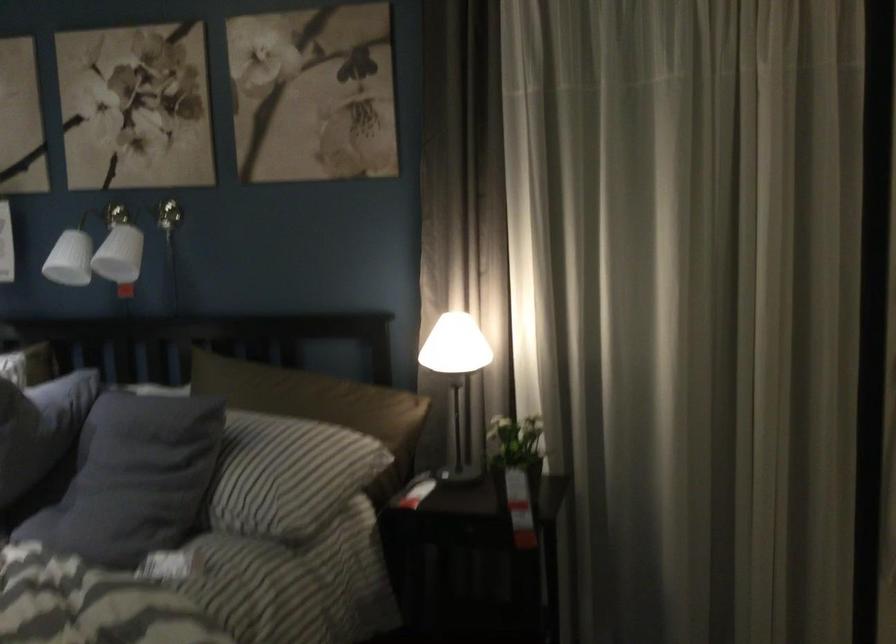
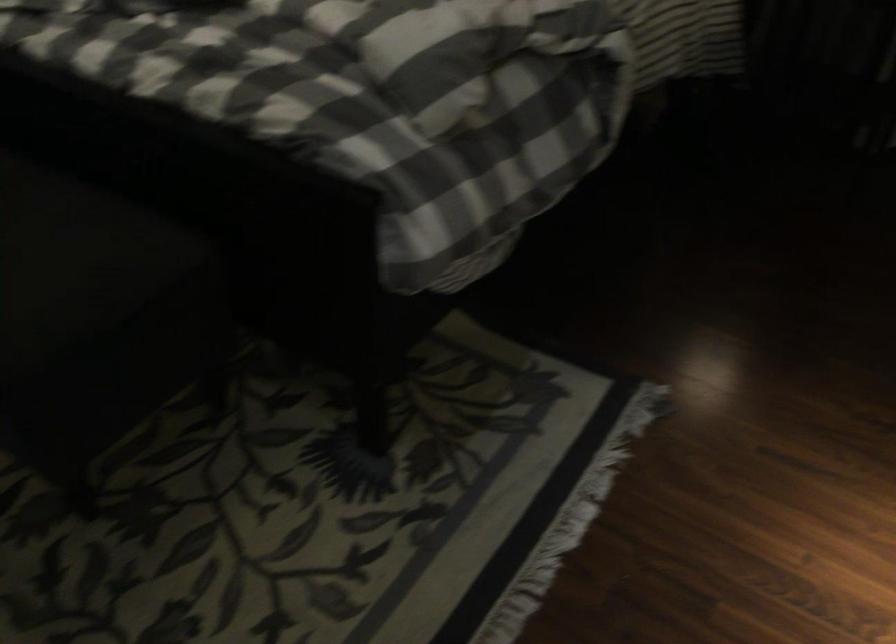
Based on the continuous images, in which direction is the camera rotating?

The rotation direction of the camera is left-down.